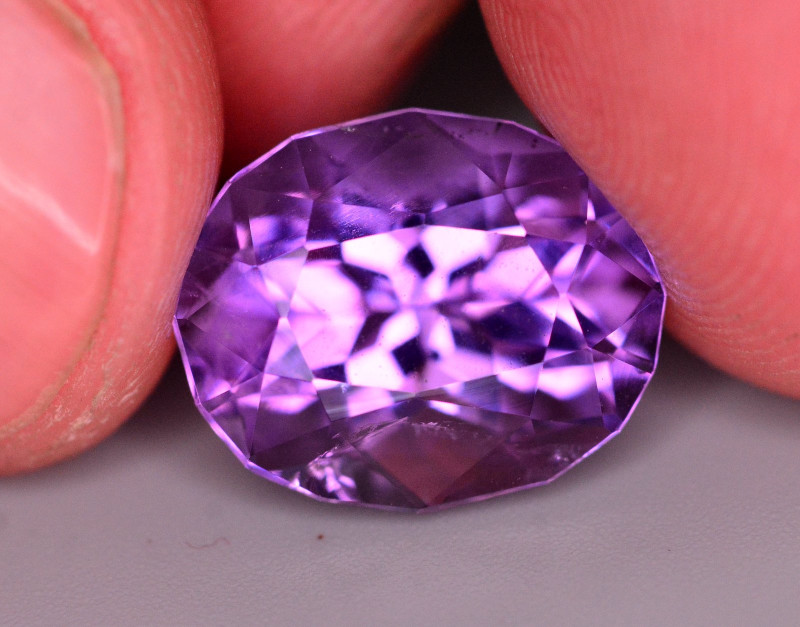
Find the location of a particular element. dust is located at coordinates (228, 542), (221, 537), (210, 545), (197, 544), (186, 540), (150, 540), (321, 535), (668, 552).